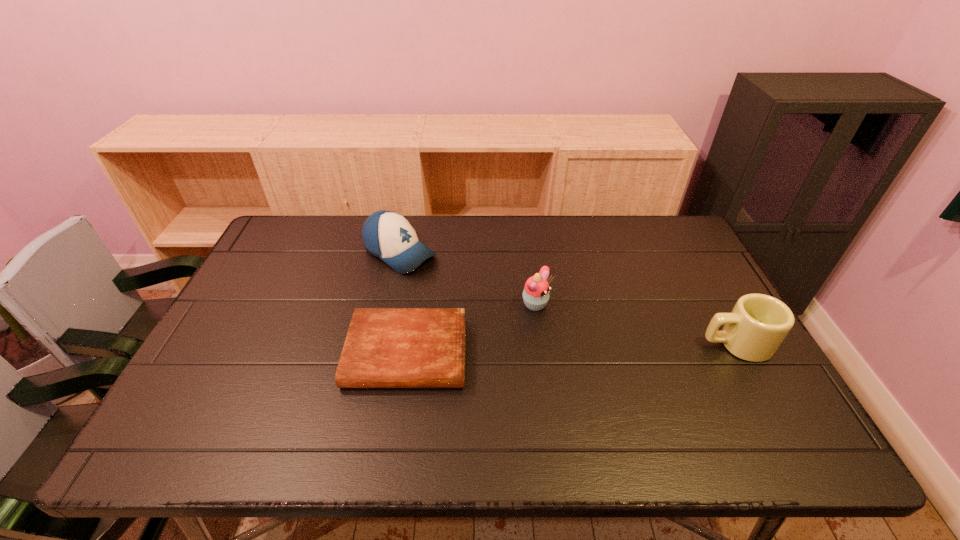
I want to click on vacant space on the desktop that is between the Bible and the rightmost object and is positioned on the front-facing side of the farthest object, so click(x=563, y=349).

Identify the location of free space on the desktop that is between the Bible and the mug and is positioned on the face of the second object from right to left. The image size is (960, 540). (608, 348).